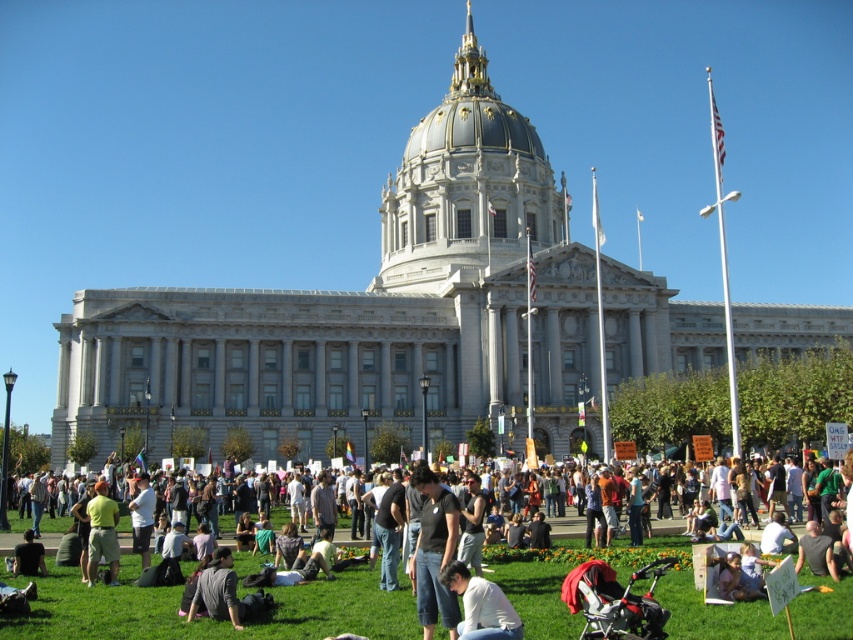
Can you confirm if dark gray jeans at center is smaller than gray cotton shirt at lower center?

No.

Is dark gray jeans at center to the right of gray cotton shirt at lower center from the viewer's perspective?

Yes, dark gray jeans at center is to the right of gray cotton shirt at lower center.

Who is more distant from viewer, (706, 608) or (207, 588)?

The point (706, 608) is behind.

The image size is (853, 640). I want to click on dark gray jeans at center, so pyautogui.click(x=210, y=620).

Is gray cotton shirt at lower center positioned behind dark gray shirt at lower left?

No.

You are a GUI agent. You are given a task and a screenshot of the screen. Output one action in this format:
    pyautogui.click(x=<x>, y=<y>)
    Task: Click on the gray cotton shirt at lower center
    
    Given the screenshot: What is the action you would take?
    pyautogui.click(x=218, y=589)

This screenshot has width=853, height=640. I want to click on gray cotton shirt at lower center, so point(218,589).

Between dark gray cotton shirt at center and dark gray shirt at lower left, which one appears on the left side from the viewer's perspective?

From the viewer's perspective, dark gray shirt at lower left appears more on the left side.

Consider the image. Is dark gray cotton shirt at center positioned at the back of dark gray shirt at lower left?

No.

Does point (450, 554) come closer to viewer compared to point (33, 550)?

Yes, point (450, 554) is in front of point (33, 550).

Find the location of a particular element. This screenshot has width=853, height=640. dark gray cotton shirt at center is located at coordinates (434, 552).